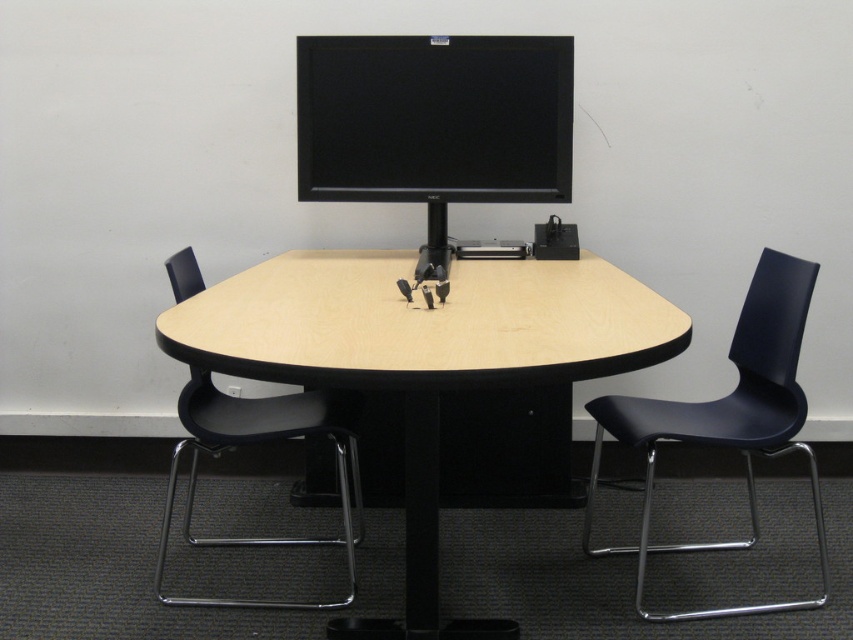
Does point (474, 72) come closer to viewer compared to point (762, 429)?

No.

Who is taller, black matte monitor at upper center or black plastic chair at right?

Standing taller between the two is black plastic chair at right.

Identify the location of black matte monitor at upper center. (434, 118).

Where is `black matte monitor at upper center`? black matte monitor at upper center is located at coordinates point(434,118).

The image size is (853, 640). Describe the element at coordinates (727, 419) in the screenshot. I see `black plastic chair at right` at that location.

Is black plastic chair at right above black plastic swivel chair at lower left?

Actually, black plastic chair at right is below black plastic swivel chair at lower left.

Is point (792, 422) positioned after point (195, 262)?

That is False.

I want to click on black plastic chair at right, so click(x=727, y=419).

Is black matte monitor at upper center to the left of black plastic swivel chair at lower left from the viewer's perspective?

No, black matte monitor at upper center is not to the left of black plastic swivel chair at lower left.

In order to click on black matte monitor at upper center in this screenshot , I will do `click(434, 118)`.

This screenshot has height=640, width=853. Find the location of `black matte monitor at upper center`. black matte monitor at upper center is located at coordinates (434, 118).

Where is `black matte monitor at upper center`? black matte monitor at upper center is located at coordinates (434, 118).